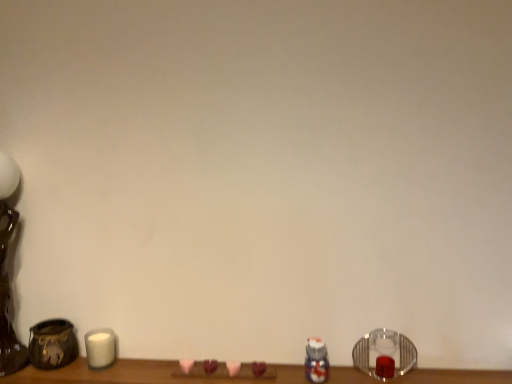
Question: Is brushed metal table lamp at left closer to the viewer compared to clear glass candle holder at lower right?

Choices:
 (A) yes
 (B) no

Answer: (A)

Question: Is brushed metal table lamp at left behind clear glass candle holder at lower right?

Choices:
 (A) yes
 (B) no

Answer: (B)

Question: From a real-world perspective, does brushed metal table lamp at left stand above clear glass candle holder at lower right?

Choices:
 (A) yes
 (B) no

Answer: (A)

Question: Is brushed metal table lamp at left positioned beyond the bounds of clear glass candle holder at lower right?

Choices:
 (A) no
 (B) yes

Answer: (B)

Question: From the image's perspective, would you say brushed metal table lamp at left is shown under clear glass candle holder at lower right?

Choices:
 (A) yes
 (B) no

Answer: (B)

Question: Visually, is white matte candle at lower left positioned to the left or to the right of clear glass candle holder at lower right?

Choices:
 (A) left
 (B) right

Answer: (A)

Question: From a real-world perspective, is white matte candle at lower left above or below clear glass candle holder at lower right?

Choices:
 (A) above
 (B) below

Answer: (B)

Question: In terms of size, does white matte candle at lower left appear bigger or smaller than clear glass candle holder at lower right?

Choices:
 (A) big
 (B) small

Answer: (B)

Question: Considering the positions of point (109, 357) and point (385, 365), is point (109, 357) closer or farther from the camera than point (385, 365)?

Choices:
 (A) closer
 (B) farther

Answer: (A)

Question: Do you think translucent plastic toy at lower right is within white matte candle at lower left, or outside of it?

Choices:
 (A) inside
 (B) outside

Answer: (B)

Question: From a real-world perspective, is translucent plastic toy at lower right physically located above or below white matte candle at lower left?

Choices:
 (A) below
 (B) above

Answer: (B)

Question: In terms of width, does translucent plastic toy at lower right look wider or thinner when compared to white matte candle at lower left?

Choices:
 (A) thin
 (B) wide

Answer: (A)

Question: Is translucent plastic toy at lower right bigger or smaller than white matte candle at lower left?

Choices:
 (A) big
 (B) small

Answer: (B)

Question: Based on their positions, is translucent plastic toy at lower right located to the left or right of brushed metal table lamp at left?

Choices:
 (A) right
 (B) left

Answer: (A)

Question: From a real-world perspective, relative to brushed metal table lamp at left, is translucent plastic toy at lower right vertically above or below?

Choices:
 (A) above
 (B) below

Answer: (B)